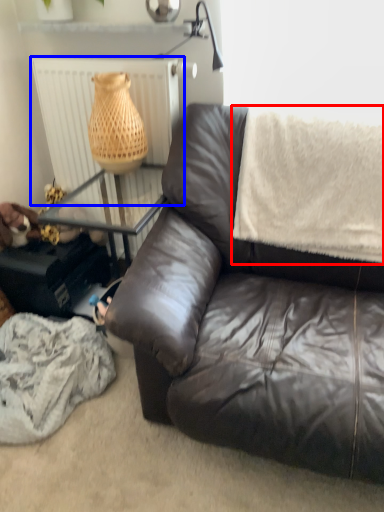
Question: Which object is further to the camera taking this photo, blanket (highlighted by a red box) or radiator (highlighted by a blue box)?

Choices:
 (A) blanket
 (B) radiator

Answer: (B)